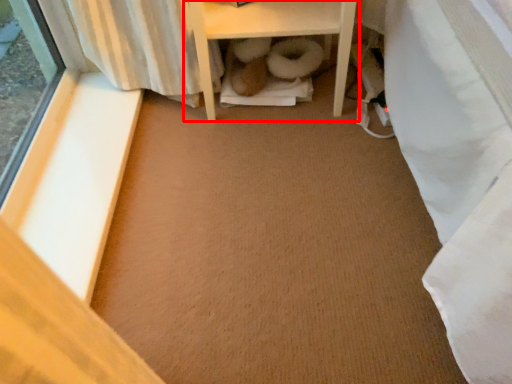
Question: Where is furniture (annotated by the red box) located in relation to window sill in the image?

Choices:
 (A) right
 (B) left

Answer: (A)